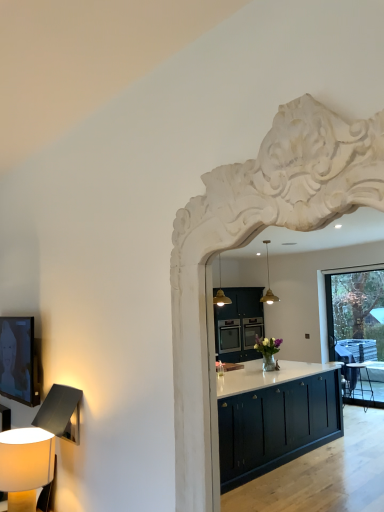
Question: Considering the positions of matte beige lampshade at lower left and white carved wood archway at upper center in the image, is matte beige lampshade at lower left wider or thinner than white carved wood archway at upper center?

Choices:
 (A) wide
 (B) thin

Answer: (A)

Question: Is matte beige lampshade at lower left bigger or smaller than white carved wood archway at upper center?

Choices:
 (A) big
 (B) small

Answer: (B)

Question: Is matte beige lampshade at lower left taller or shorter than white carved wood archway at upper center?

Choices:
 (A) tall
 (B) short

Answer: (B)

Question: Considering the positions of point (223, 222) and point (13, 433), is point (223, 222) closer or farther from the camera than point (13, 433)?

Choices:
 (A) farther
 (B) closer

Answer: (B)

Question: From the image's perspective, is white carved wood archway at upper center above or below matte beige lampshade at lower left?

Choices:
 (A) below
 (B) above

Answer: (B)

Question: Considering their positions, is white carved wood archway at upper center located in front of or behind matte beige lampshade at lower left?

Choices:
 (A) behind
 (B) front

Answer: (B)

Question: Is white carved wood archway at upper center inside the boundaries of matte beige lampshade at lower left, or outside?

Choices:
 (A) inside
 (B) outside

Answer: (B)